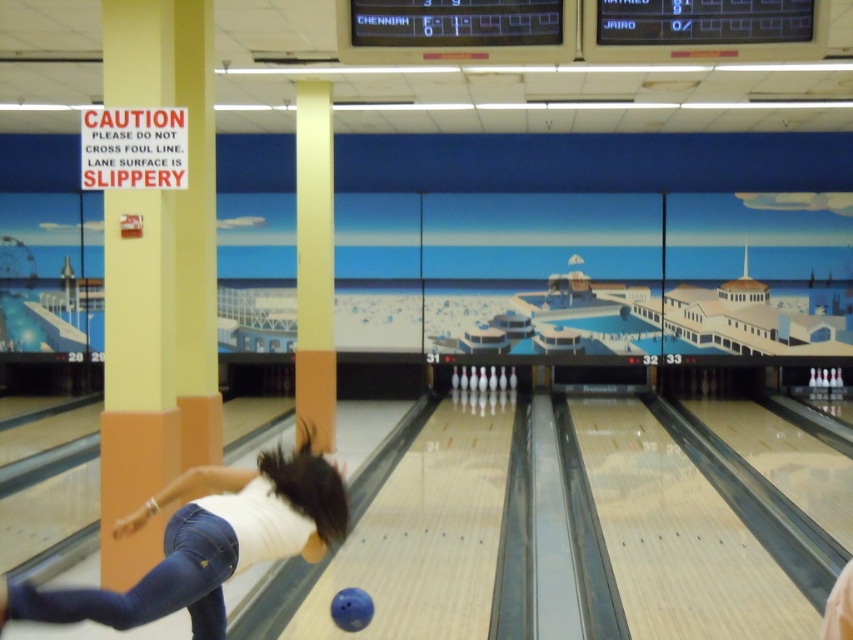
You are a photographer positioned at the back of the bowling alley. You want to take a photo of the white matte shirt at center and denim at left. Which one will appear closer to the camera in the photo?

The white matte shirt at center will appear closer to the camera because it is in front of the denim at left.

You are a spectator standing at the back of the bowling alley and want to take a photo of the white matte shirt at center and the blue rubber bowling ball at center. Which object should you focus on first to ensure both are in the frame?

You should focus on the white matte shirt at center first because it is closer to you than the blue rubber bowling ball at center, ensuring both are in the frame.